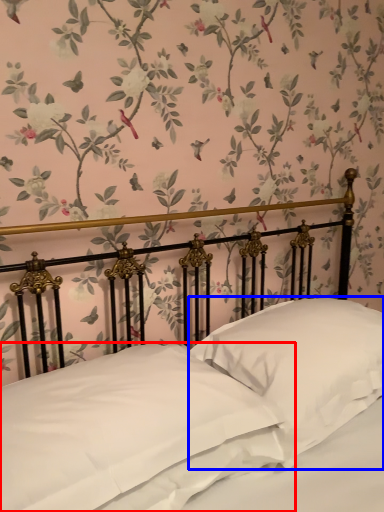
Question: Which point is further to the camera, pillow (highlighted by a red box) or pillow (highlighted by a blue box)?

Choices:
 (A) pillow
 (B) pillow

Answer: (B)